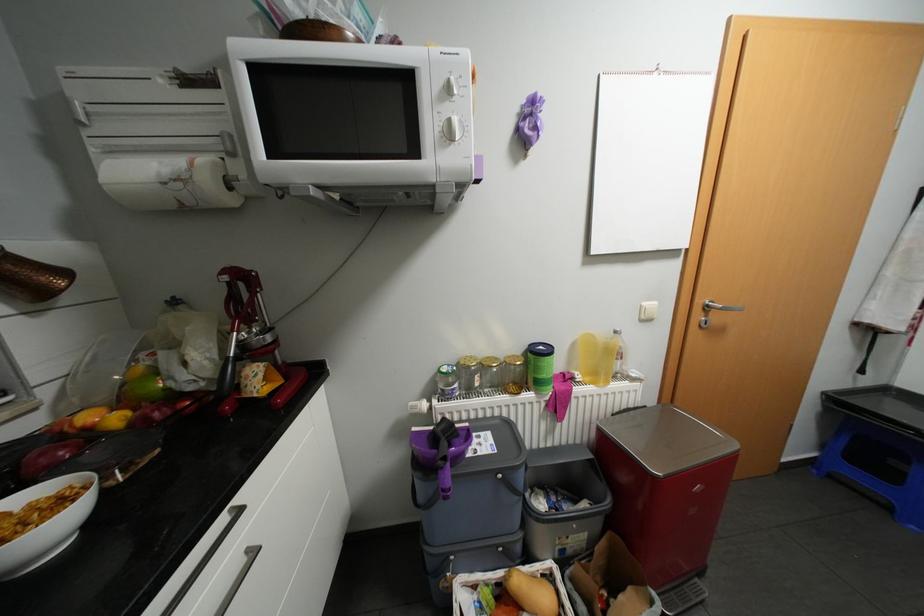
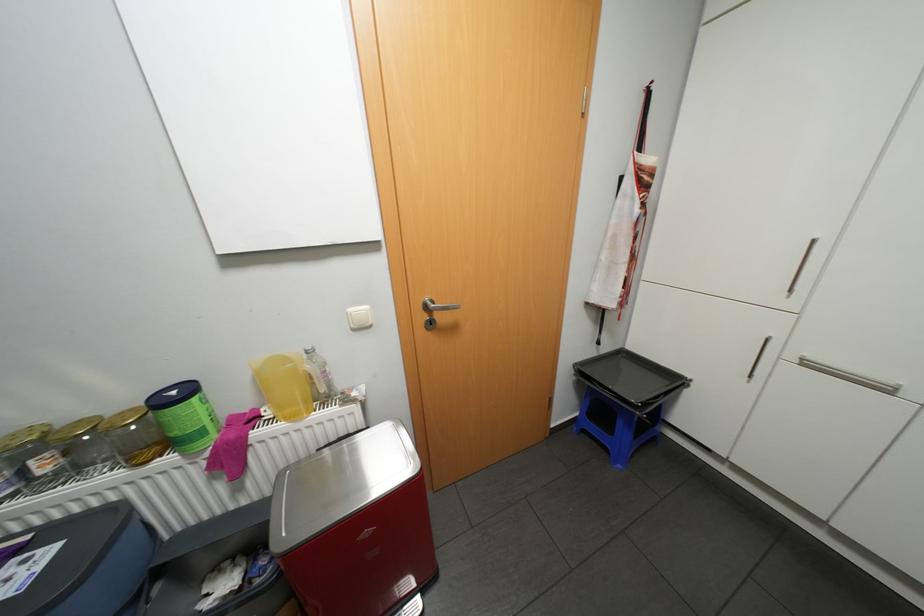
Find the pixel in the second image that matches pixel 840 476 in the first image.

(591, 431)